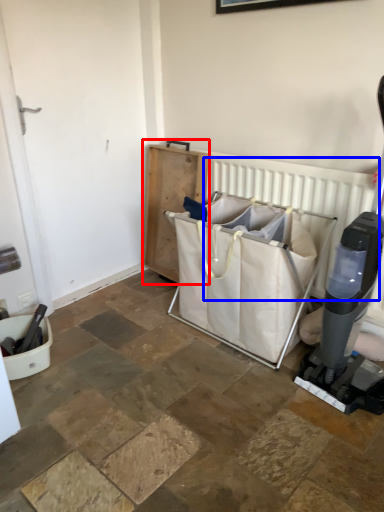
Question: Which of the following is the closest to the observer, furniture (highlighted by a red box) or radiator (highlighted by a blue box)?

Choices:
 (A) furniture
 (B) radiator

Answer: (B)